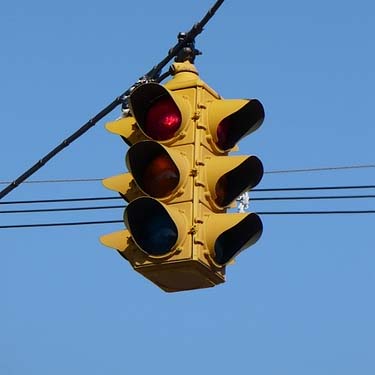
The width and height of the screenshot is (375, 375). I want to click on bottom square base of light, so click(x=173, y=282).